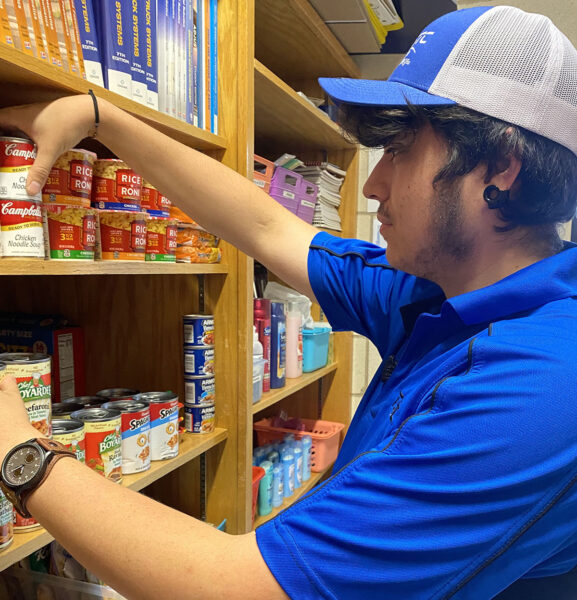
You are a GUI agent. You are given a task and a screenshot of the screen. Output one action in this format:
    pyautogui.click(x=<x>, y=<y>)
    Task: Click on the shelf
    The image size is (577, 600).
    Given the screenshot: What is the action you would take?
    pyautogui.click(x=146, y=344)